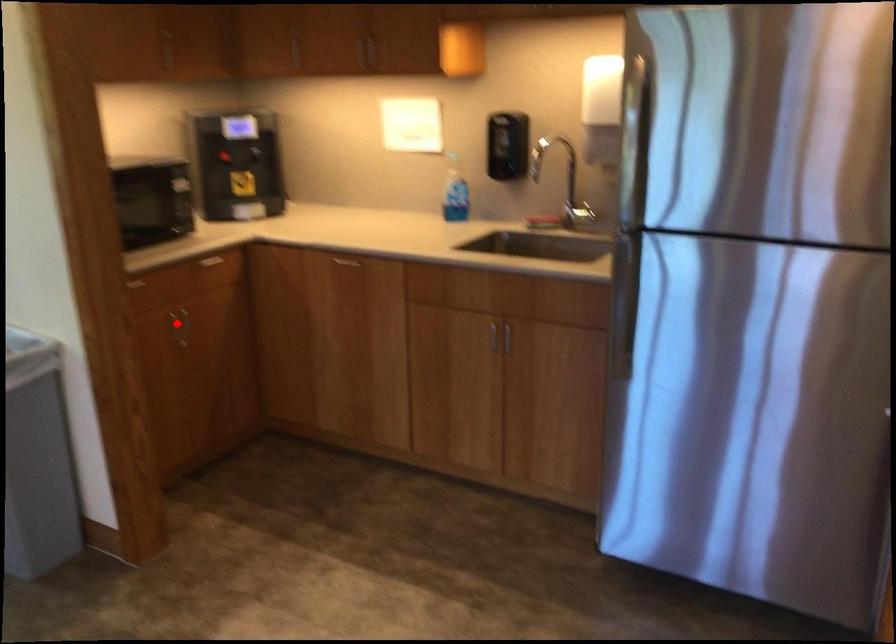
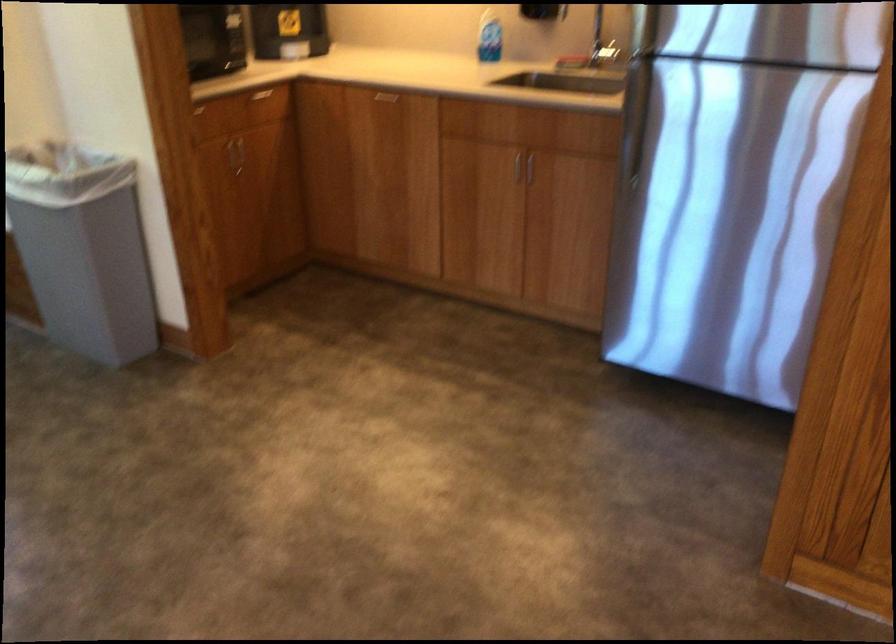
Question: I am providing you with two images of the same scene from different viewpoints. A red point is shown in image1. For the corresponding object point in image2, is it positioned nearer or farther from the camera?

Choices:
 (A) Nearer
 (B) Farther

Answer: (B)